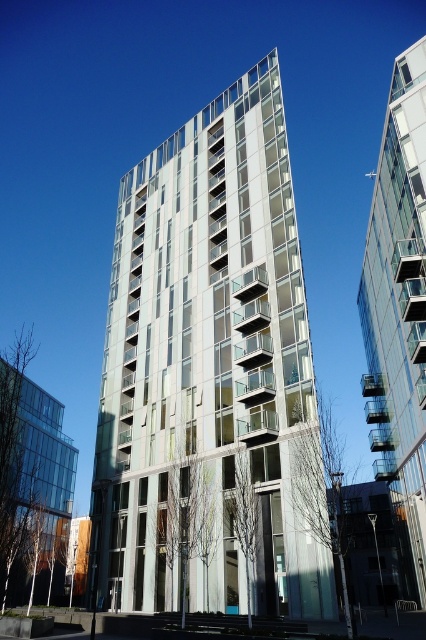
Measure the distance between metallic glass building at center and transparent glass building at upper right.

They are 14.67 meters apart.

The height and width of the screenshot is (640, 426). Find the location of `metallic glass building at center`. metallic glass building at center is located at coordinates (212, 378).